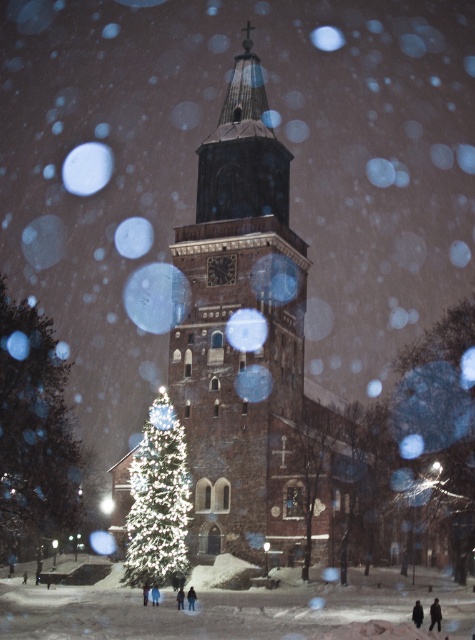
Question: From the image, what is the correct spatial relationship of brown stone church at center in relation to green frosted tree at right?

Choices:
 (A) above
 (B) below

Answer: (A)

Question: Which object appears farthest from the camera in this image?

Choices:
 (A) illuminated glass christmas tree at center
 (B) green frosted tree at left

Answer: (B)

Question: Is green frosted tree at left thinner than illuminated glass christmas tree at center?

Choices:
 (A) no
 (B) yes

Answer: (A)

Question: Among these objects, which one is farthest from the camera?

Choices:
 (A) illuminated glass christmas tree at center
 (B) green frosted tree at right
 (C) green frosted tree at left
 (D) brown stone church at center

Answer: (C)

Question: Does green frosted tree at left appear on the left side of illuminated glass christmas tree at center?

Choices:
 (A) no
 (B) yes

Answer: (B)

Question: Which point appears closest to the camera in this image?

Choices:
 (A) (208, 310)
 (B) (38, 392)
 (C) (437, 336)
 (D) (170, 408)

Answer: (D)